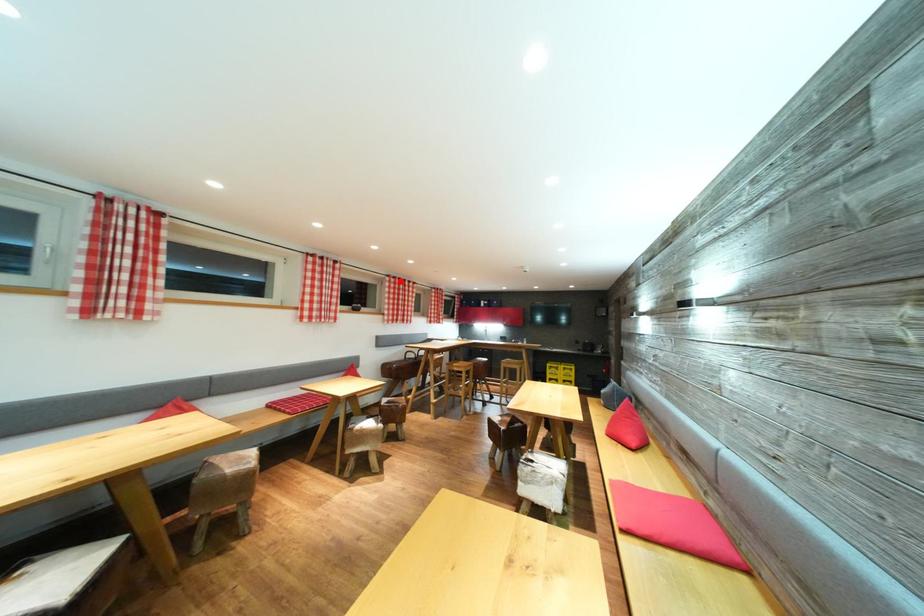
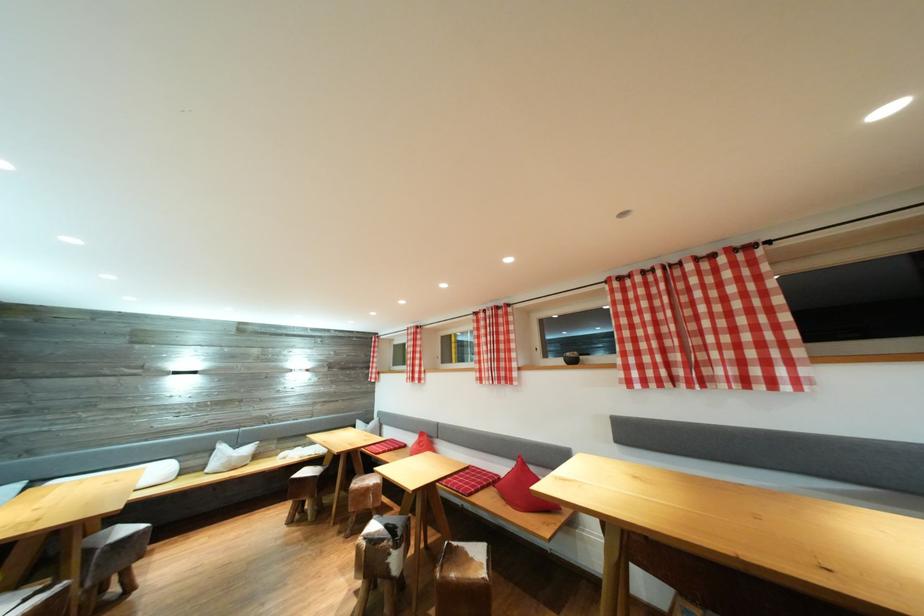
Question: I am providing you with two images of the same scene from different viewpoints. A red point is marked on the first image. At the location where the point appears in image 1, is it still visible in image 2?

Choices:
 (A) Yes
 (B) No

Answer: (A)